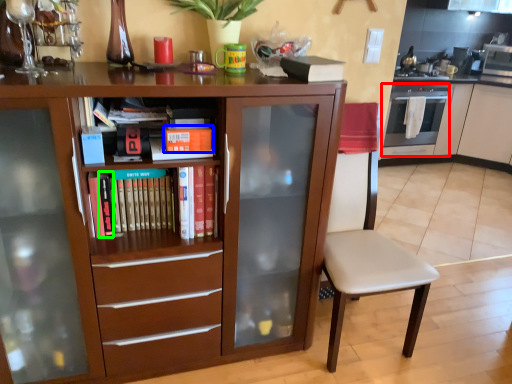
Question: Which object is the farthest from oven (highlighted by a red box)? Choose among these: paperback book (highlighted by a blue box) or paperback book (highlighted by a green box).

Choices:
 (A) paperback book
 (B) paperback book

Answer: (B)